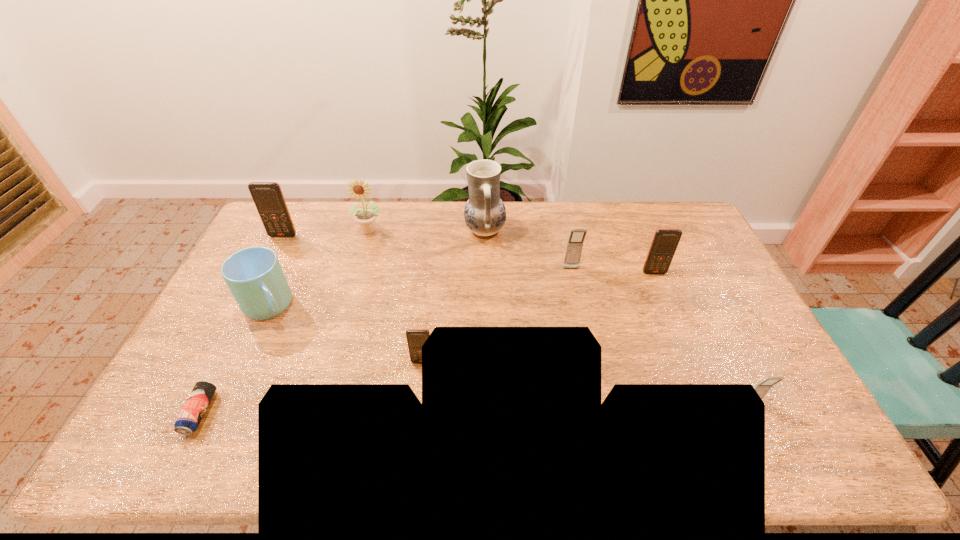
Locate an element on the screen. mug is located at coordinates (254, 275).

This screenshot has width=960, height=540. Find the location of `the second nearest cellular telephone`. the second nearest cellular telephone is located at coordinates (416, 338).

The width and height of the screenshot is (960, 540). In order to click on the second orange cellular telephone from right to left in this screenshot , I will do `click(416, 338)`.

Locate an element on the screen. This screenshot has height=540, width=960. the nearer gray cellular telephone is located at coordinates (763, 387).

In order to click on the right gray cellular telephone in this screenshot , I will do `click(763, 387)`.

Locate an element on the screen. The height and width of the screenshot is (540, 960). blue beer can is located at coordinates (198, 401).

Image resolution: width=960 pixels, height=540 pixels. Find the location of `beer can`. beer can is located at coordinates (198, 401).

This screenshot has width=960, height=540. Identify the location of vacant space located 0.260m on the right of the fourth object from right to left. (576, 232).

In order to click on vacant space situated on the front-facing side of the sunflower in this screenshot , I will do `click(349, 305)`.

Locate an element on the screen. The width and height of the screenshot is (960, 540). blank space located 0.340m on the screen of the biggest orange cellular telephone is located at coordinates (247, 308).